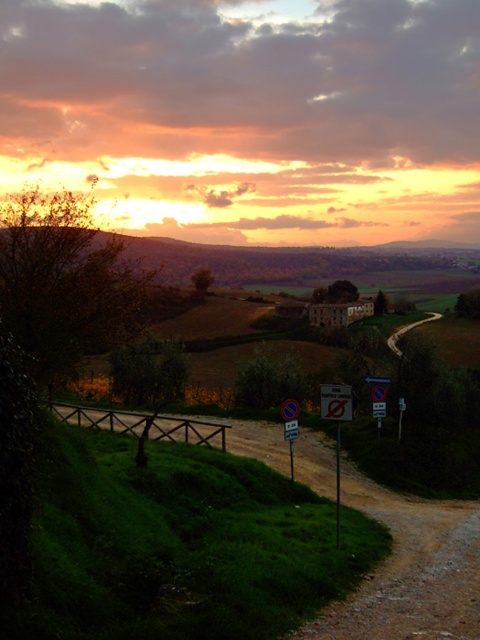
Between dirt/gravel path at lower left and white plastic sign at center, which one is positioned lower?

Positioned lower is dirt/gravel path at lower left.

Is dirt/gravel path at lower left closer to the viewer compared to white plastic sign at center?

Yes.

Which is in front, point (232, 444) or point (333, 388)?

Point (333, 388) is in front.

This screenshot has width=480, height=640. What are the coordinates of `dirt/gravel path at lower left` in the screenshot? It's located at (409, 570).